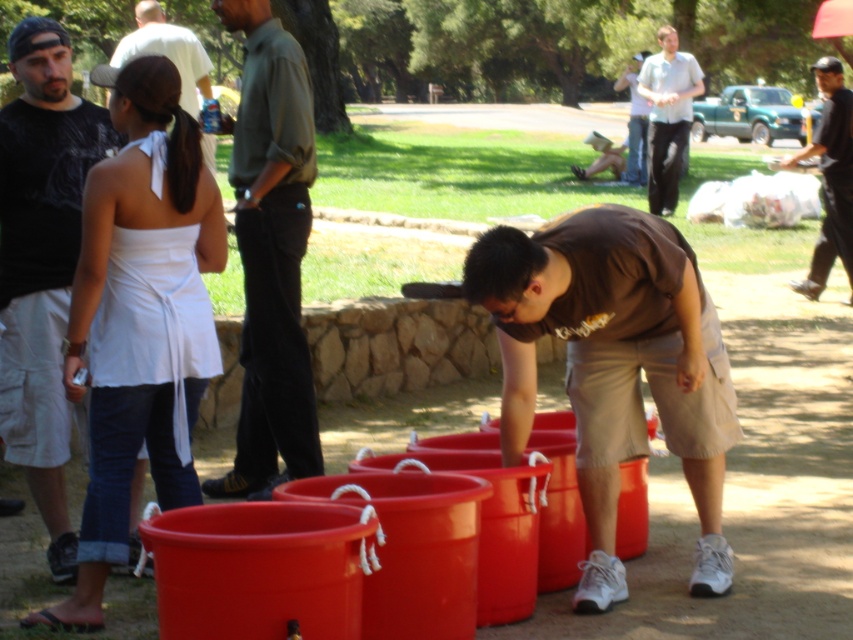
Can you confirm if white fabric dress at left is positioned below black cotton shirt at upper right?

Indeed, white fabric dress at left is positioned under black cotton shirt at upper right.

Between point (97, 280) and point (816, 70), which one is positioned behind?

The point (816, 70) is behind.

At what (x,y) coordinates should I click in order to perform the action: click on white fabric dress at left. Please return your answer as a coordinate pair (x, y). This screenshot has height=640, width=853. Looking at the image, I should click on (141, 193).

Is brown cotton shirt at center thinner than dark green shirt at center?

Incorrect, brown cotton shirt at center's width is not less than dark green shirt at center's.

Which is above, brown cotton shirt at center or dark green shirt at center?

Positioned higher is dark green shirt at center.

Between point (625, 593) and point (252, 28), which one is positioned behind?

The point (252, 28) is behind.

At what (x,y) coordinates should I click in order to perform the action: click on brown cotton shirt at center. Please return your answer as a coordinate pair (x, y). The width and height of the screenshot is (853, 640). Looking at the image, I should click on (614, 365).

Based on the photo, can you confirm if white fabric dress at upper left is positioned to the right of matte white shirt at upper center?

Incorrect, white fabric dress at upper left is not on the right side of matte white shirt at upper center.

Who is more distant from viewer, (181, 33) or (642, 97)?

Positioned behind is point (642, 97).

Where is `white fabric dress at upper left`? The width and height of the screenshot is (853, 640). white fabric dress at upper left is located at coordinates (167, 51).